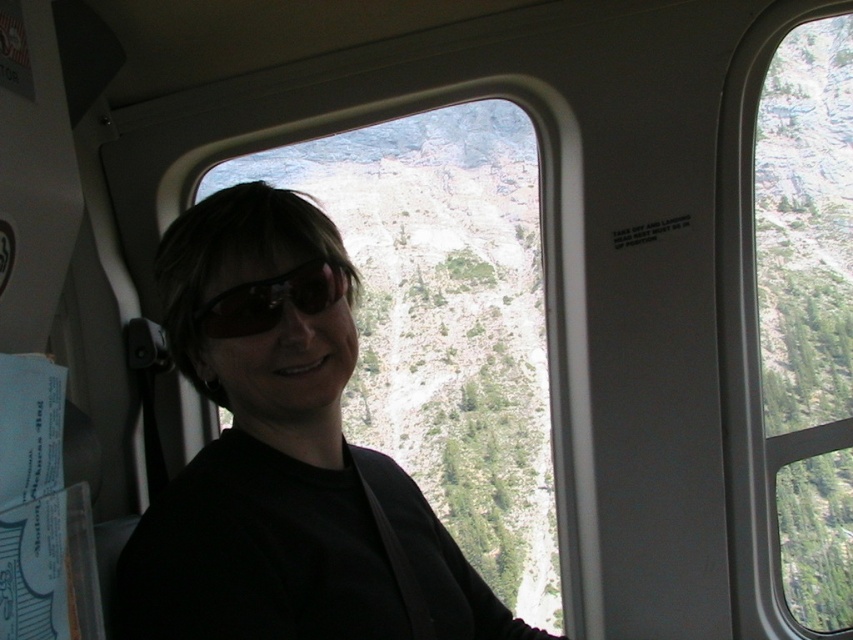
Question: Does transparent glass window at right have a lesser width compared to black reflective sunglasses at center?

Choices:
 (A) no
 (B) yes

Answer: (A)

Question: Which object is positioned closest to the transparent glass window at right?

Choices:
 (A) black reflective sunglasses at center
 (B) matte black shirt at center

Answer: (B)

Question: Considering the relative positions of transparent glass window at right and black reflective sunglasses at center in the image provided, where is transparent glass window at right located with respect to black reflective sunglasses at center?

Choices:
 (A) right
 (B) left

Answer: (A)

Question: Which of the following is the farthest from the observer?

Choices:
 (A) transparent glass window at right
 (B) matte black shirt at center

Answer: (A)

Question: Which is farther from the black reflective sunglasses at center?

Choices:
 (A) matte black shirt at center
 (B) transparent glass window at right

Answer: (B)

Question: Does transparent glass window at right appear on the left side of black reflective sunglasses at center?

Choices:
 (A) no
 (B) yes

Answer: (A)